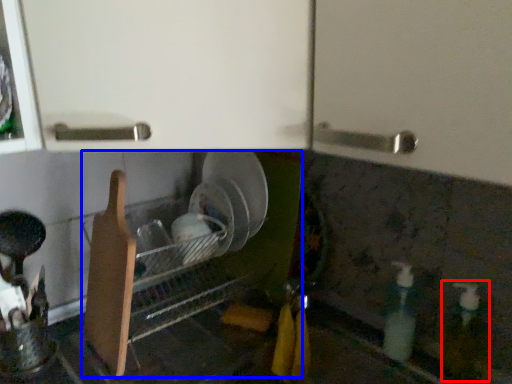
Question: Which object appears farthest to the camera in this image, bottle (highlighted by a red box) or dish washer (highlighted by a blue box)?

Choices:
 (A) bottle
 (B) dish washer

Answer: (B)